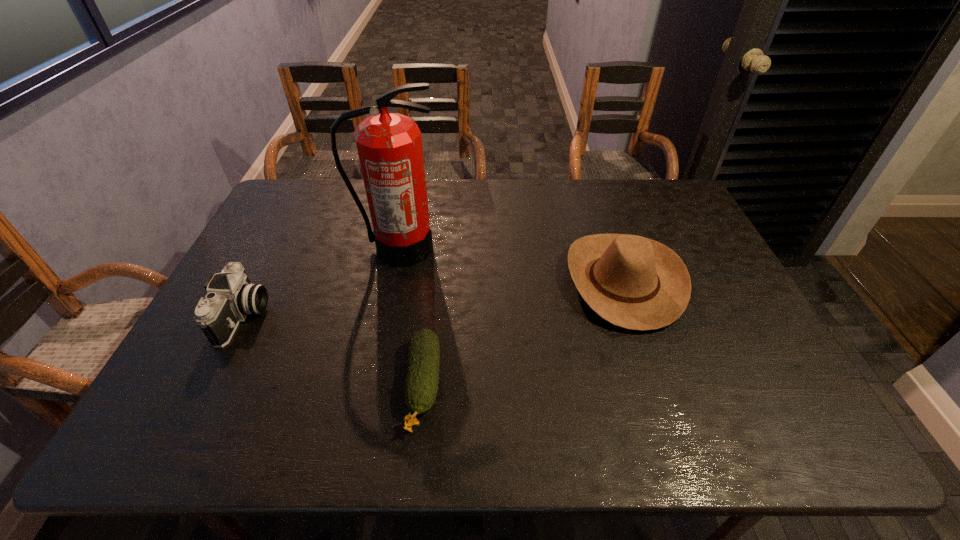
Where is `vacant space that's between the cucumber and the fire extinguisher`? Image resolution: width=960 pixels, height=540 pixels. vacant space that's between the cucumber and the fire extinguisher is located at coordinates (411, 317).

Identify the location of vacant point located between the cowboy hat and the leftmost object. (433, 299).

The height and width of the screenshot is (540, 960). I want to click on free spot between the shortest object and the leftmost object, so click(333, 351).

At what (x,y) coordinates should I click in order to perform the action: click on free space between the rightmost object and the camera. Please return your answer as a coordinate pair (x, y). Looking at the image, I should click on (433, 299).

At what (x,y) coordinates should I click in order to perform the action: click on free space between the camera and the cowboy hat. Please return your answer as a coordinate pair (x, y). Image resolution: width=960 pixels, height=540 pixels. Looking at the image, I should click on (x=433, y=299).

In order to click on vacant area that lies between the shortest object and the tallest object in this screenshot , I will do `click(411, 317)`.

Identify the location of empty space that is in between the shortest object and the camera. (333, 351).

You are a GUI agent. You are given a task and a screenshot of the screen. Output one action in this format:
    pyautogui.click(x=<x>, y=<y>)
    Task: Click on the vacant point located between the fire extinguisher and the cowboy hat
    The width and height of the screenshot is (960, 540).
    Given the screenshot: What is the action you would take?
    pyautogui.click(x=511, y=265)

Identify which object is the third closest to the fire extinguisher. Please provide its 2D coordinates. Your answer should be formatted as a tuple, i.e. [(x, y)], where the tuple contains the x and y coordinates of a point satisfying the conditions above.

[(633, 282)]

Find the location of a particular element. object that is the third closest to the cowboy hat is located at coordinates (231, 296).